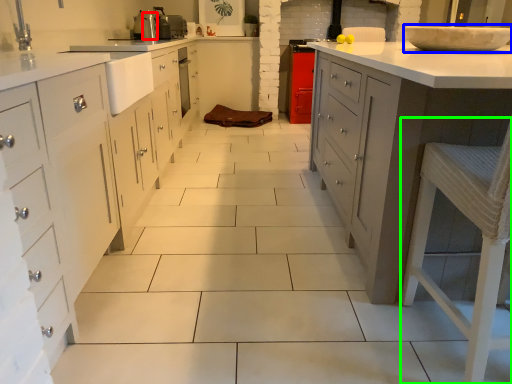
Question: Which object is positioned closest to appliance (highlighted by a red box)? Select from home appliance (highlighted by a blue box) and bar stool (highlighted by a green box).

Choices:
 (A) home appliance
 (B) bar stool

Answer: (A)